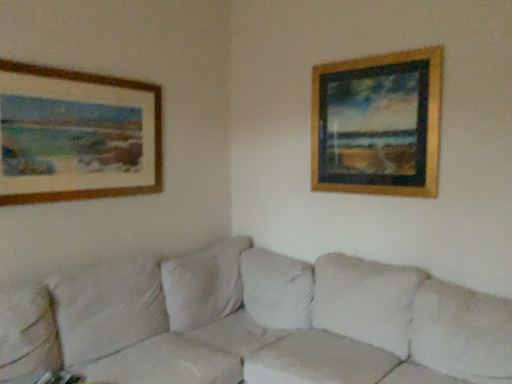
Question: Considering the relative sizes of wooden picture frame at upper left, which is the second picture frame in right-to-left order, and gold wooden picture frame at upper right, the 2th picture frame positioned from the left, in the image provided, is wooden picture frame at upper left, which is the second picture frame in right-to-left order, smaller than gold wooden picture frame at upper right, the 2th picture frame positioned from the left,?

Choices:
 (A) yes
 (B) no

Answer: (A)

Question: Does wooden picture frame at upper left, placed as the 1th picture frame when sorted from left to right, appear on the right side of gold wooden picture frame at upper right, the 2th picture frame positioned from the left?

Choices:
 (A) no
 (B) yes

Answer: (A)

Question: Is gold wooden picture frame at upper right, the first picture frame positioned from the right, located within wooden picture frame at upper left, placed as the 1th picture frame when sorted from left to right?

Choices:
 (A) yes
 (B) no

Answer: (B)

Question: Can you confirm if wooden picture frame at upper left, which is the second picture frame in right-to-left order, is positioned to the left of gold wooden picture frame at upper right, the 2th picture frame positioned from the left?

Choices:
 (A) no
 (B) yes

Answer: (B)

Question: Is wooden picture frame at upper left, placed as the 1th picture frame when sorted from left to right, positioned beyond the bounds of gold wooden picture frame at upper right, the first picture frame positioned from the right?

Choices:
 (A) yes
 (B) no

Answer: (A)

Question: From a real-world perspective, is wooden picture frame at upper left, placed as the 1th picture frame when sorted from left to right, beneath gold wooden picture frame at upper right, the first picture frame positioned from the right?

Choices:
 (A) no
 (B) yes

Answer: (B)

Question: Is white fabric couch at center to the left of gold wooden picture frame at upper right, the first picture frame positioned from the right, from the viewer's perspective?

Choices:
 (A) yes
 (B) no

Answer: (A)

Question: Does white fabric couch at center have a lesser height compared to gold wooden picture frame at upper right, the first picture frame positioned from the right?

Choices:
 (A) no
 (B) yes

Answer: (B)

Question: From the image's perspective, is white fabric couch at center below gold wooden picture frame at upper right, the 2th picture frame positioned from the left?

Choices:
 (A) yes
 (B) no

Answer: (A)

Question: Is white fabric couch at center to the right of gold wooden picture frame at upper right, the first picture frame positioned from the right, from the viewer's perspective?

Choices:
 (A) no
 (B) yes

Answer: (A)

Question: Could you tell me if white fabric couch at center is turned towards gold wooden picture frame at upper right, the first picture frame positioned from the right?

Choices:
 (A) no
 (B) yes

Answer: (A)

Question: Is gold wooden picture frame at upper right, the first picture frame positioned from the right, surrounded by white fabric couch at center?

Choices:
 (A) no
 (B) yes

Answer: (A)

Question: Can you confirm if gold wooden picture frame at upper right, the first picture frame positioned from the right, is thinner than white fabric couch at center?

Choices:
 (A) no
 (B) yes

Answer: (B)